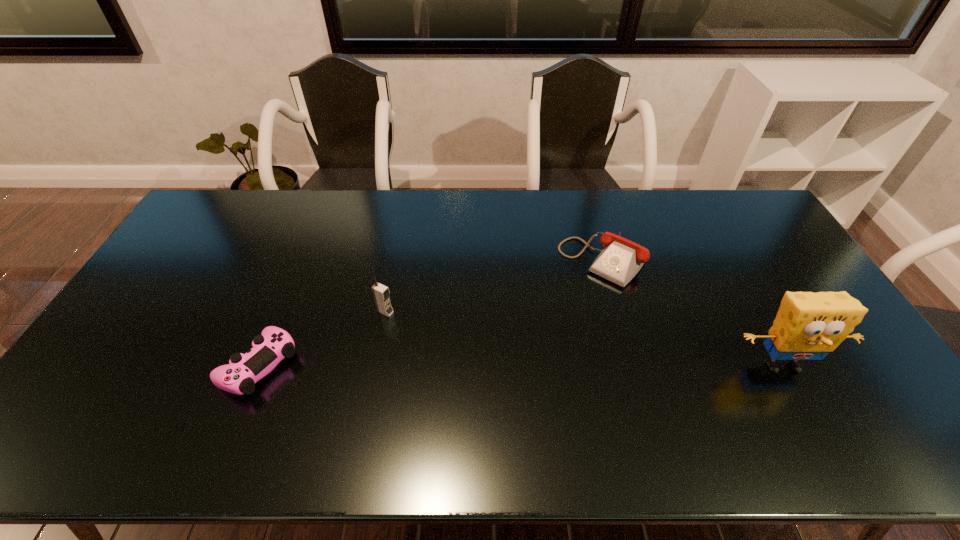
This screenshot has height=540, width=960. In order to click on control in this screenshot , I will do `click(238, 377)`.

At what (x,y) coordinates should I click in order to perform the action: click on the rightmost object. Please return your answer as a coordinate pair (x, y). Looking at the image, I should click on (808, 325).

Locate an element on the screen. The image size is (960, 540). the tallest object is located at coordinates (808, 325).

Where is `the third nearest object`? The image size is (960, 540). the third nearest object is located at coordinates (381, 293).

Where is `the second object from left to right`? This screenshot has width=960, height=540. the second object from left to right is located at coordinates (381, 293).

Find the location of a particular element. the farthest object is located at coordinates point(621,259).

This screenshot has width=960, height=540. Find the location of `the third object from left to right`. the third object from left to right is located at coordinates (621, 259).

Identify the location of vacant area located on the left of the leftmost object. (104, 365).

This screenshot has width=960, height=540. What are the coordinates of `vacant space located on the front-facing side of the second object from left to right` in the screenshot? It's located at (477, 358).

At what (x,y) coordinates should I click in order to perform the action: click on free space located on the front-facing side of the second object from left to right. Please return your answer as a coordinate pair (x, y). The height and width of the screenshot is (540, 960). Looking at the image, I should click on (474, 356).